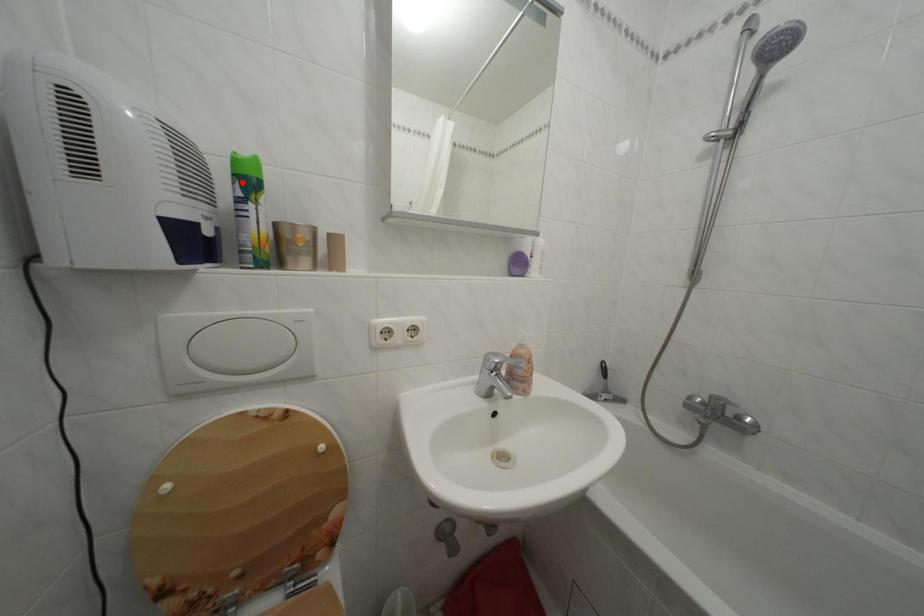
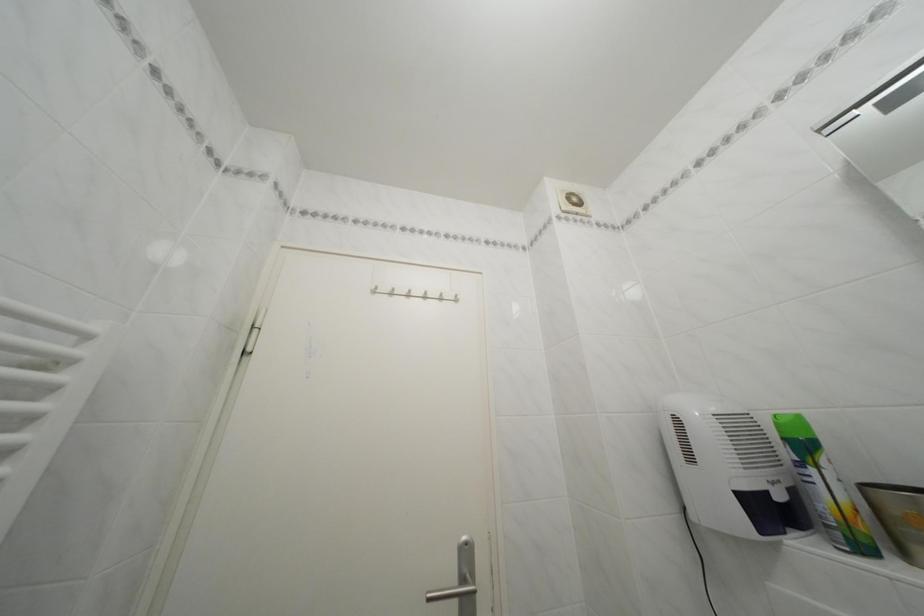
The point at the highlighted location is marked in the first image. Where is the corresponding point in the second image?

(793, 445)